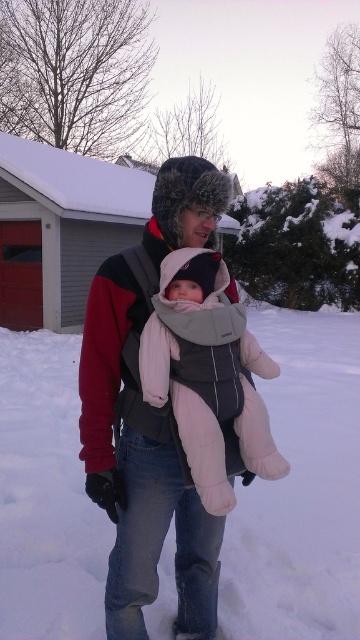
You are standing in the winter scene and want to place a small snowman between the two points labeled as point (194, 520) and point (195, 440). Which point should the snowman be closer to in order to be closer to the camera?

The snowman should be closer to point (194, 520) because it is further to the camera than point (195, 440).

You are a photographer trying to capture a candid shot of the baby in the light pink fleece baby carrier at center without the man noticing. Since the gray fleece jacket at center is blocking your view, can you estimate if you can see the baby by looking over the top of the jacket?

The gray fleece jacket at center is taller than the light pink fleece baby carrier at center, so looking over the top of the jacket may not allow you to see the baby since the jacket is taller than the carrier.

In the scene shown: You are a photographer trying to capture the baby in the light pink fleece baby carrier at center. You want to focus on the baby without the man in the gray fleece jacket at center blocking the shot. Can you move closer to the baby to avoid the man blocking the view?

The gray fleece jacket at center is further to the viewer than the light pink fleece baby carrier at center, so moving closer to the baby would bring the man in front of the baby, making it harder to avoid the blockage. You should move backward instead to create more distance between them.